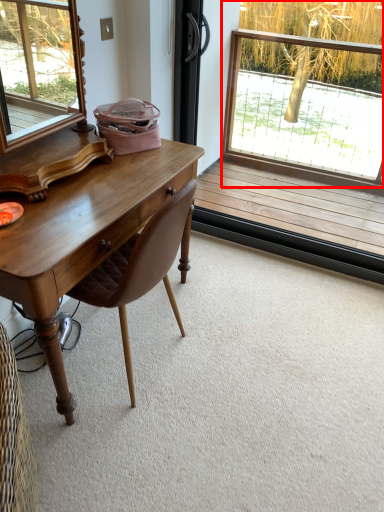
Question: Where is window (annotated by the red box) located in relation to chair in the image?

Choices:
 (A) right
 (B) left

Answer: (A)